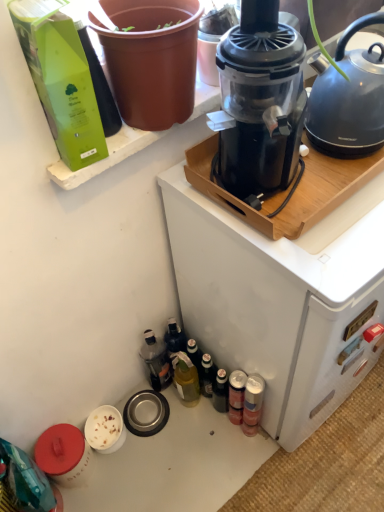
Question: Is green glass bottle at lower center, which is counted as the 2th bottle, starting from the left, beside metallic silver can at lower right, which ranks as the third bottle in left-to-right order?

Choices:
 (A) no
 (B) yes

Answer: (A)

Question: From a real-world perspective, does green glass bottle at lower center, which is counted as the 3th bottle, starting from the right, sit lower than metallic silver can at lower right, which ranks as the third bottle in left-to-right order?

Choices:
 (A) no
 (B) yes

Answer: (A)

Question: Is green glass bottle at lower center, which is counted as the 2th bottle, starting from the left, aimed at metallic silver can at lower right, which ranks as the third bottle in left-to-right order?

Choices:
 (A) yes
 (B) no

Answer: (B)

Question: From the image's perspective, is green glass bottle at lower center, which is counted as the 3th bottle, starting from the right, located above metallic silver can at lower right, the 2th bottle in the right-to-left sequence?

Choices:
 (A) no
 (B) yes

Answer: (B)

Question: Can you confirm if green glass bottle at lower center, which is counted as the 3th bottle, starting from the right, is wider than metallic silver can at lower right, the 2th bottle in the right-to-left sequence?

Choices:
 (A) yes
 (B) no

Answer: (A)

Question: Can you confirm if green glass bottle at lower center, which is counted as the 2th bottle, starting from the left, is shorter than metallic silver can at lower right, which ranks as the third bottle in left-to-right order?

Choices:
 (A) no
 (B) yes

Answer: (A)

Question: Are transparent plastic juicer at upper center and brown matte flowerpot at upper left located far from each other?

Choices:
 (A) yes
 (B) no

Answer: (B)

Question: Considering the relative sizes of transparent plastic juicer at upper center and brown matte flowerpot at upper left in the image provided, is transparent plastic juicer at upper center shorter than brown matte flowerpot at upper left?

Choices:
 (A) yes
 (B) no

Answer: (B)

Question: Is the surface of transparent plastic juicer at upper center in direct contact with brown matte flowerpot at upper left?

Choices:
 (A) no
 (B) yes

Answer: (A)

Question: From the image's perspective, is transparent plastic juicer at upper center on top of brown matte flowerpot at upper left?

Choices:
 (A) yes
 (B) no

Answer: (B)

Question: Is transparent plastic juicer at upper center completely or partially outside of brown matte flowerpot at upper left?

Choices:
 (A) yes
 (B) no

Answer: (A)

Question: Is transparent plastic juicer at upper center taller than brown matte flowerpot at upper left?

Choices:
 (A) no
 (B) yes

Answer: (B)

Question: Does metallic silver can at lower right, which is the 4th bottle in left-to-right order, have a lesser height compared to metallic silver can at lower right, the 2th bottle in the right-to-left sequence?

Choices:
 (A) no
 (B) yes

Answer: (A)